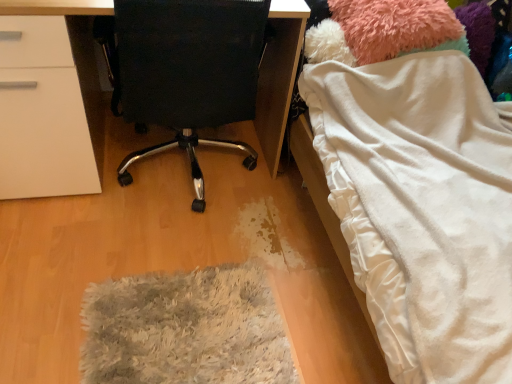
Locate an element on the screen. This screenshot has height=384, width=512. gray shaggy rug at lower center is located at coordinates (185, 329).

Measure the distance between point (206, 115) and camera.

Point (206, 115) and camera are 4.98 feet apart from each other.

Identify the location of white soft blanket at right. (423, 208).

Between black fabric chair at center and gray shaggy rug at lower center, which one has more height?

black fabric chair at center is taller.

Considering the relative positions of black fabric chair at center and gray shaggy rug at lower center in the image provided, is black fabric chair at center to the left or to the right of gray shaggy rug at lower center?

black fabric chair at center is positioned on gray shaggy rug at lower center's left side.

Looking at this image, from the image's perspective, is black fabric chair at center below gray shaggy rug at lower center?

Incorrect, from the image's perspective, black fabric chair at center is higher than gray shaggy rug at lower center.

Is the position of black fabric chair at center less distant than that of gray shaggy rug at lower center?

Yes, black fabric chair at center is closer to the viewer.

Can you confirm if fuzzy pink teddy at upper right is bigger than white soft blanket at right?

Actually, fuzzy pink teddy at upper right might be smaller than white soft blanket at right.

From the image's perspective, would you say fuzzy pink teddy at upper right is shown under white soft blanket at right?

Incorrect, from the image's perspective, fuzzy pink teddy at upper right is higher than white soft blanket at right.

Based on their positions, is fuzzy pink teddy at upper right located to the left or right of white soft blanket at right?

fuzzy pink teddy at upper right is positioned on white soft blanket at right's left side.

From a real-world perspective, is fuzzy pink teddy at upper right under white soft blanket at right?

No, from a real-world perspective, fuzzy pink teddy at upper right is not beneath white soft blanket at right.

Considering their positions, is white soft blanket at right located in front of or behind black fabric chair at center?

In the image, white soft blanket at right appears in front of black fabric chair at center.

Looking at this image, is white soft blanket at right smaller than black fabric chair at center?

No, white soft blanket at right is not smaller than black fabric chair at center.

From the image's perspective, is white soft blanket at right positioned above or below black fabric chair at center?

Clearly, from the image's perspective, white soft blanket at right is below black fabric chair at center.

Is white soft blanket at right inside the boundaries of black fabric chair at center, or outside?

white soft blanket at right is spatially situated outside black fabric chair at center.

Considering the sizes of gray shaggy rug at lower center and fuzzy pink teddy at upper right in the image, is gray shaggy rug at lower center taller or shorter than fuzzy pink teddy at upper right?

Considering their sizes, gray shaggy rug at lower center has less height than fuzzy pink teddy at upper right.

From the image's perspective, which one is positioned higher, gray shaggy rug at lower center or fuzzy pink teddy at upper right?

fuzzy pink teddy at upper right, from the image's perspective.

Is point (253, 282) behind point (426, 48)?

That is False.

Can you confirm if gray shaggy rug at lower center is thinner than fuzzy pink teddy at upper right?

No, gray shaggy rug at lower center is not thinner than fuzzy pink teddy at upper right.

Who is smaller, gray shaggy rug at lower center or white soft blanket at right?

gray shaggy rug at lower center is smaller.

From a real-world perspective, relative to white soft blanket at right, is gray shaggy rug at lower center vertically above or below?

Clearly, from a real-world perspective, gray shaggy rug at lower center is below white soft blanket at right.

This screenshot has width=512, height=384. Find the location of `blanket above the gray shaggy rug at lower center (from the image's perspective)`. blanket above the gray shaggy rug at lower center (from the image's perspective) is located at coordinates (423, 208).

Is white soft blanket at right located within gray shaggy rug at lower center?

No.

Does black fabric chair at center turn towards white soft blanket at right?

No, black fabric chair at center is not aimed at white soft blanket at right.

Which object is thinner, black fabric chair at center or white soft blanket at right?

Thinner between the two is black fabric chair at center.

Who is shorter, black fabric chair at center or white soft blanket at right?

white soft blanket at right.

I want to click on chair that appears below the fuzzy pink teddy at upper right (from a real-world perspective), so click(x=184, y=71).

Is black fabric chair at center smaller than fuzzy pink teddy at upper right?

Actually, black fabric chair at center might be larger than fuzzy pink teddy at upper right.

Considering the relative sizes of black fabric chair at center and fuzzy pink teddy at upper right in the image provided, is black fabric chair at center wider than fuzzy pink teddy at upper right?

Yes.

Is black fabric chair at center far away from fuzzy pink teddy at upper right?

No, black fabric chair at center is not far away from fuzzy pink teddy at upper right.

Identify the location of mat on the right of black fabric chair at center. The width and height of the screenshot is (512, 384). (185, 329).

What are the coordinates of `teddy lying behind the white soft blanket at right` in the screenshot? It's located at (381, 30).

From the picture: When comparing their distances from gray shaggy rug at lower center, does black fabric chair at center or fuzzy pink teddy at upper right seem closer?

black fabric chair at center lies closer to gray shaggy rug at lower center than the other object.

Which object lies further to the anchor point black fabric chair at center, gray shaggy rug at lower center or white soft blanket at right?

Based on the image, gray shaggy rug at lower center appears to be further to black fabric chair at center.

Based on their spatial positions, is fuzzy pink teddy at upper right or black fabric chair at center further from gray shaggy rug at lower center?

fuzzy pink teddy at upper right is further to gray shaggy rug at lower center.

From the image, which object appears to be farther from black fabric chair at center, gray shaggy rug at lower center or fuzzy pink teddy at upper right?

gray shaggy rug at lower center lies further to black fabric chair at center than the other object.

From the image, which object appears to be nearer to black fabric chair at center, fuzzy pink teddy at upper right or gray shaggy rug at lower center?

Based on the image, fuzzy pink teddy at upper right appears to be nearer to black fabric chair at center.

From the image, which object appears to be farther from white soft blanket at right, black fabric chair at center or gray shaggy rug at lower center?

The object further to white soft blanket at right is gray shaggy rug at lower center.

Looking at this image, based on their spatial positions, is gray shaggy rug at lower center or white soft blanket at right further from fuzzy pink teddy at upper right?

gray shaggy rug at lower center lies further to fuzzy pink teddy at upper right than the other object.

Considering their positions, is black fabric chair at center positioned closer to white soft blanket at right than fuzzy pink teddy at upper right?

fuzzy pink teddy at upper right lies closer to white soft blanket at right than the other object.

Identify the location of blanket between fuzzy pink teddy at upper right and gray shaggy rug at lower center from top to bottom. (423, 208).

Locate an element on the screen. Image resolution: width=512 pixels, height=384 pixels. chair between fuzzy pink teddy at upper right and gray shaggy rug at lower center in the up-down direction is located at coordinates (184, 71).

The height and width of the screenshot is (384, 512). Find the location of `mat between black fabric chair at center and white soft blanket at right from left to right`. mat between black fabric chair at center and white soft blanket at right from left to right is located at coordinates (185, 329).

The image size is (512, 384). I want to click on teddy between black fabric chair at center and white soft blanket at right, so click(381, 30).